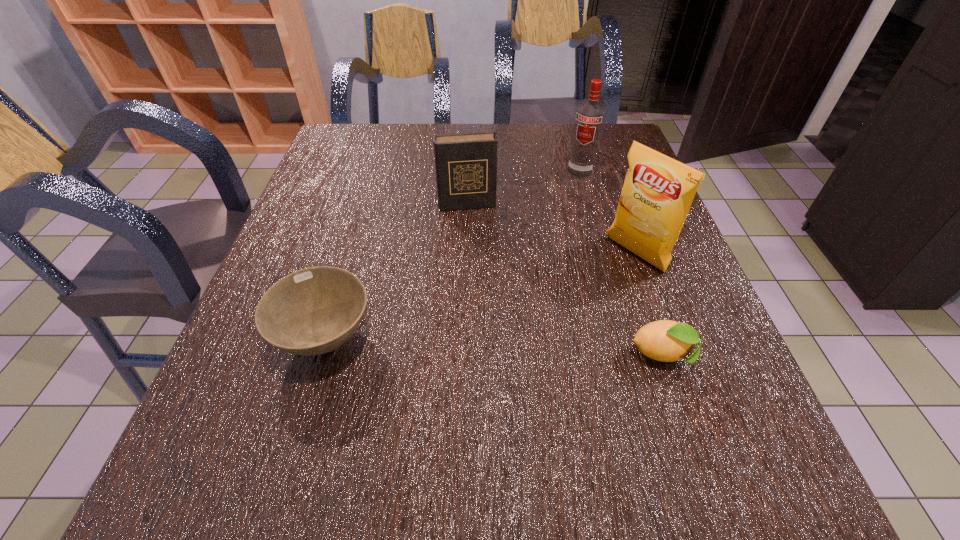
At what (x,y) coordinates should I click in order to perform the action: click on vacant area situated 0.100m on the front label of the vodka. Please return your answer as a coordinate pair (x, y). Looking at the image, I should click on (567, 198).

Locate an element on the screen. The width and height of the screenshot is (960, 540). free region located on the front label of the vodka is located at coordinates (541, 256).

Locate an element on the screen. vacant space situated 0.340m on the front cover of the third shortest object is located at coordinates (489, 320).

Locate an element on the screen. This screenshot has height=540, width=960. vacant area situated 0.160m on the front cover of the third shortest object is located at coordinates (478, 256).

You are a GUI agent. You are given a task and a screenshot of the screen. Output one action in this format:
    pyautogui.click(x=<x>, y=<y>)
    Task: Click on the free space located 0.240m on the front cover of the third shortest object
    The image size is (960, 540).
    Given the screenshot: What is the action you would take?
    pyautogui.click(x=483, y=282)

Locate an element on the screen. vacant point located 0.250m on the front of the crisp (potato chip) with the logo is located at coordinates (537, 328).

Locate an element on the screen. This screenshot has height=540, width=960. free space located on the front of the crisp (potato chip) with the logo is located at coordinates (601, 281).

I want to click on free space located on the front of the crisp (potato chip) with the logo, so click(x=582, y=295).

Where is `object at the far edge`? This screenshot has height=540, width=960. object at the far edge is located at coordinates (589, 119).

Identify the location of object situated at the left edge. The width and height of the screenshot is (960, 540). click(312, 311).